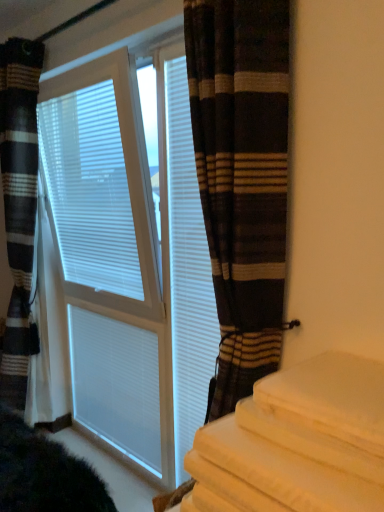
Question: From a real-world perspective, is striped fabric curtain at left, which appears as the 2th curtain when viewed from the front, beneath white matte shutter at center, the 1th shutter in the front-to-back sequence?

Choices:
 (A) no
 (B) yes

Answer: (B)

Question: Can you see striped fabric curtain at left, which appears as the 2th curtain when viewed from the front, touching white matte shutter at center, the 1th shutter in the front-to-back sequence?

Choices:
 (A) no
 (B) yes

Answer: (A)

Question: Can you confirm if striped fabric curtain at left, the 2th curtain in the right-to-left sequence, is bigger than white matte shutter at center, which ranks as the second shutter in back-to-front order?

Choices:
 (A) no
 (B) yes

Answer: (B)

Question: Does striped fabric curtain at left, the first curtain viewed from the back, have a lesser height compared to white matte shutter at center, the 1th shutter in the front-to-back sequence?

Choices:
 (A) yes
 (B) no

Answer: (B)

Question: Is striped fabric curtain at left, the 2th curtain in the right-to-left sequence, facing towards white matte shutter at center, which ranks as the second shutter in back-to-front order?

Choices:
 (A) yes
 (B) no

Answer: (B)

Question: From the image's perspective, is striped fabric curtain at left, the 1th curtain in the left-to-right sequence, beneath white matte shutter at center, the 1th shutter in the front-to-back sequence?

Choices:
 (A) no
 (B) yes

Answer: (A)

Question: Is white matte shutter at center, acting as the second shutter starting from the right, shorter than white matte blinds at center?

Choices:
 (A) no
 (B) yes

Answer: (B)

Question: Is white matte shutter at center, acting as the second shutter starting from the right, in front of white matte blinds at center?

Choices:
 (A) no
 (B) yes

Answer: (A)

Question: From a real-world perspective, is white matte shutter at center, which is the first shutter from left to right, on white matte blinds at center?

Choices:
 (A) no
 (B) yes

Answer: (A)

Question: Can you confirm if white matte shutter at center, which appears as the second shutter when viewed from the front, is wider than white matte blinds at center?

Choices:
 (A) no
 (B) yes

Answer: (A)

Question: Is white matte shutter at center, acting as the second shutter starting from the right, oriented away from white matte blinds at center?

Choices:
 (A) yes
 (B) no

Answer: (B)

Question: Is white matte shutter at center, which appears as the second shutter when viewed from the front, thinner than white matte blinds at center?

Choices:
 (A) no
 (B) yes

Answer: (B)

Question: Considering the relative sizes of white textured blinds at center and white matte shutter at center, acting as the second shutter starting from the right, in the image provided, is white textured blinds at center wider than white matte shutter at center, acting as the second shutter starting from the right,?

Choices:
 (A) yes
 (B) no

Answer: (A)